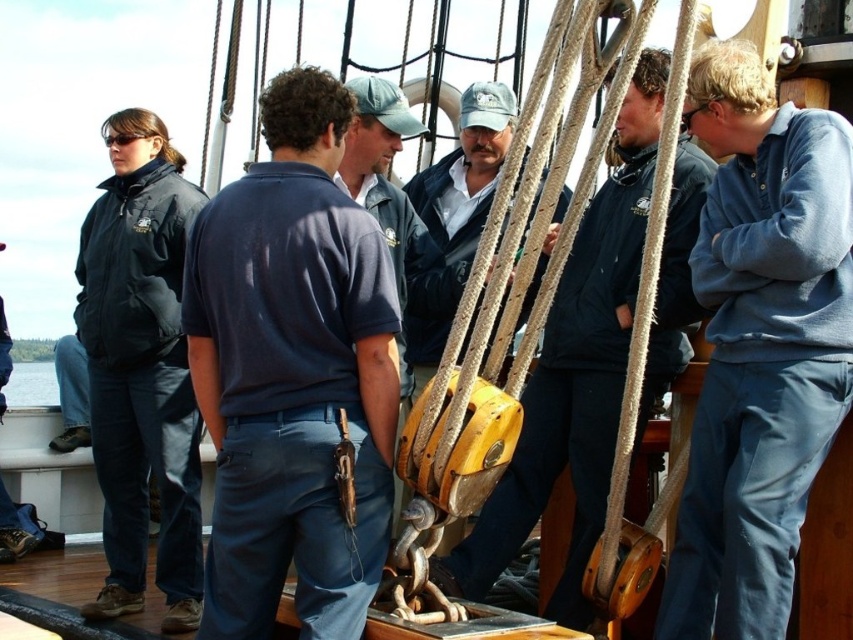
From the picture: You are standing on the deck of a ship and see two jackets hanging on hooks nearby. The jackets are the dark blue jacket at center and the black matte jacket at left. Which jacket is taller?

The dark blue jacket at center is much taller than the black matte jacket at left.

You are standing on the deck of the boat and need to hand a tool to the person wearing the light blue fleece at right. Which direction should you walk from the black matte jacket at left to reach them?

The light blue fleece at right is located to the right of the black matte jacket at left, so you should walk to the right from the black matte jacket at left to reach the light blue fleece at right.